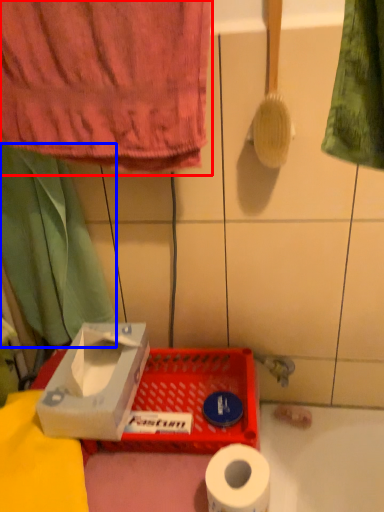
Question: Which object is further to the camera taking this photo, towel (highlighted by a red box) or curtain (highlighted by a blue box)?

Choices:
 (A) towel
 (B) curtain

Answer: (B)